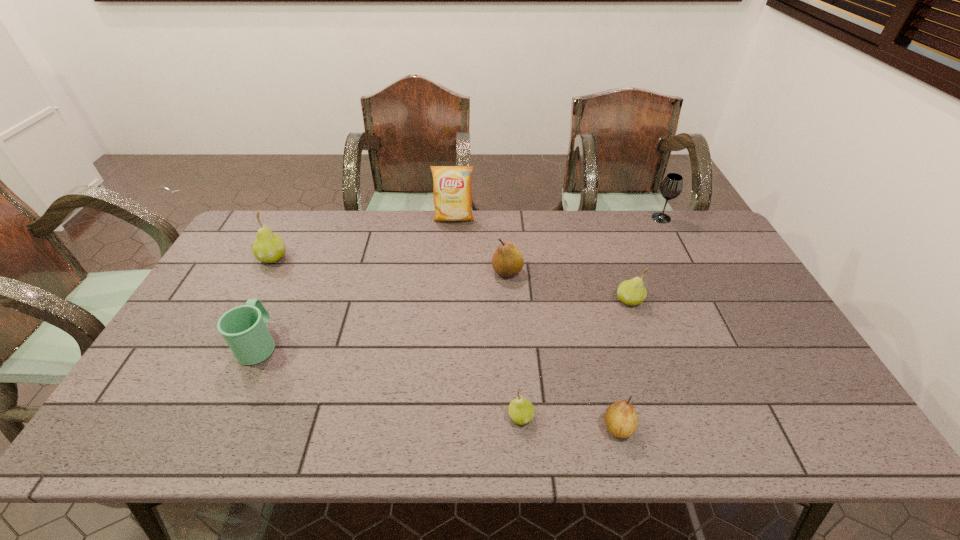
The width and height of the screenshot is (960, 540). In order to click on vacant space situated 0.160m on the left of the fourth nearest object in this screenshot , I will do `click(561, 300)`.

This screenshot has height=540, width=960. I want to click on free spot located on the side of the third nearest object with the handle, so click(x=302, y=250).

You are a GUI agent. You are given a task and a screenshot of the screen. Output one action in this format:
    pyautogui.click(x=<x>, y=<y>)
    Task: Click on the blank space located 0.380m on the side of the third nearest object with the handle
    Image resolution: width=960 pixels, height=540 pixels.
    Given the screenshot: What is the action you would take?
    pyautogui.click(x=308, y=239)

At what (x,y) coordinates should I click in order to perform the action: click on vacant space located 0.390m on the side of the third nearest object with the handle. Please return your answer as a coordinate pair (x, y). Image resolution: width=960 pixels, height=540 pixels. Looking at the image, I should click on (309, 237).

Locate an element on the screen. Image resolution: width=960 pixels, height=540 pixels. vacant space located 0.350m on the left of the second green pear from left to right is located at coordinates (357, 417).

Locate an element on the screen. vacant area situated 0.350m on the back of the nearer brown pear is located at coordinates (588, 304).

I want to click on crisp (potato chip) at the far edge, so click(452, 189).

Find the location of a particular element. The width and height of the screenshot is (960, 540). wineglass at the far edge is located at coordinates (671, 187).

Where is `pear that is at the far edge`? Image resolution: width=960 pixels, height=540 pixels. pear that is at the far edge is located at coordinates (268, 247).

Identify the location of object situated at the left edge. (268, 247).